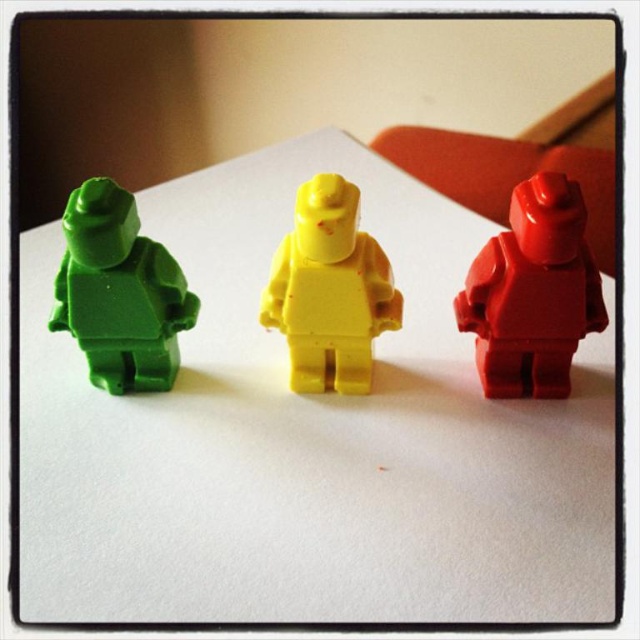
Question: Is white paper at center further to the viewer compared to yellow matte plastic minifigure at center?

Choices:
 (A) no
 (B) yes

Answer: (A)

Question: Which of the following is the closest to the observer?

Choices:
 (A) white paper at center
 (B) yellow matte plastic minifigure at center
 (C) matte red figure at right
 (D) matte green plastic figure at left

Answer: (A)

Question: Which point is farther from the camera taking this photo?

Choices:
 (A) (300, 369)
 (B) (224, 586)
 (C) (509, 259)
 (D) (116, 236)

Answer: (A)

Question: Considering the real-world distances, which object is farthest from the yellow matte plastic minifigure at center?

Choices:
 (A) white paper at center
 (B) matte green plastic figure at left

Answer: (B)

Question: Is matte red figure at right further to the viewer compared to matte green plastic figure at left?

Choices:
 (A) yes
 (B) no

Answer: (B)

Question: Is matte red figure at right wider than yellow matte plastic minifigure at center?

Choices:
 (A) no
 (B) yes

Answer: (A)